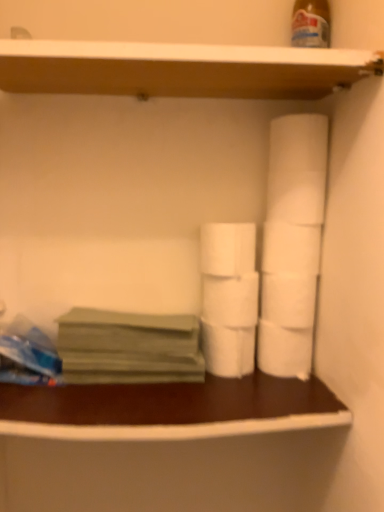
The width and height of the screenshot is (384, 512). Identify the location of vacant point above green matte paper at left (from a real-world perspective). 133,305.